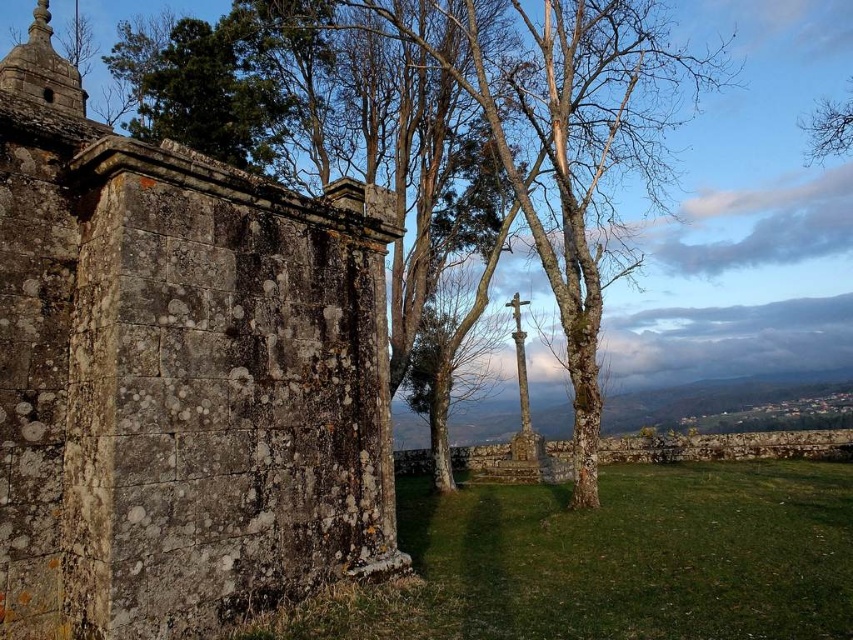
Question: Where is rusty stone wall at left located in relation to bare wood tree at upper right in the image?

Choices:
 (A) right
 (B) left

Answer: (B)

Question: Among these objects, which one is nearest to the camera?

Choices:
 (A) rusty stone wall at left
 (B) bare wood tree at upper right

Answer: (A)

Question: Is rusty stone wall at left bigger than bare wood tree at upper right?

Choices:
 (A) no
 (B) yes

Answer: (A)

Question: Which point is farther from the camera taking this photo?

Choices:
 (A) (820, 156)
 (B) (392, 467)

Answer: (A)

Question: Is rusty stone wall at left bigger than bare wood tree at upper right?

Choices:
 (A) no
 (B) yes

Answer: (A)